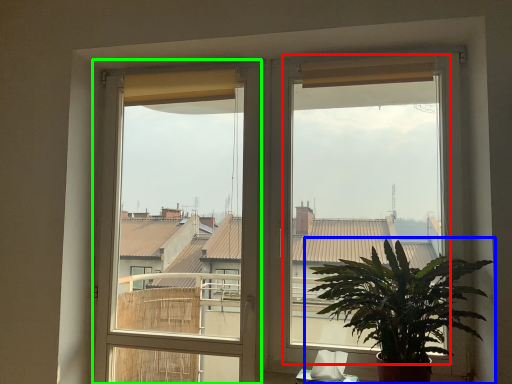
Question: Estimate the real-world distances between objects in this image. Which object is farther from window screen (highlighted by a red box), houseplant (highlighted by a blue box) or window frame (highlighted by a green box)?

Choices:
 (A) houseplant
 (B) window frame

Answer: (B)